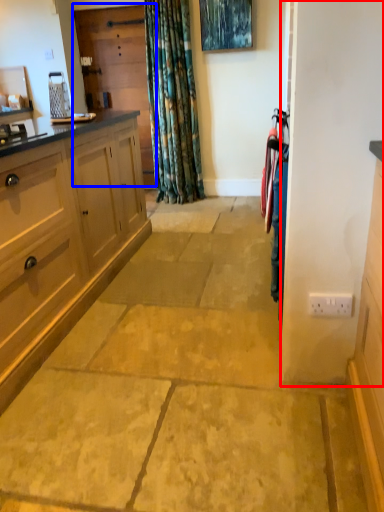
Question: Which of the following is the farthest to the observer, screen door (highlighted by a red box) or screen door (highlighted by a blue box)?

Choices:
 (A) screen door
 (B) screen door

Answer: (B)